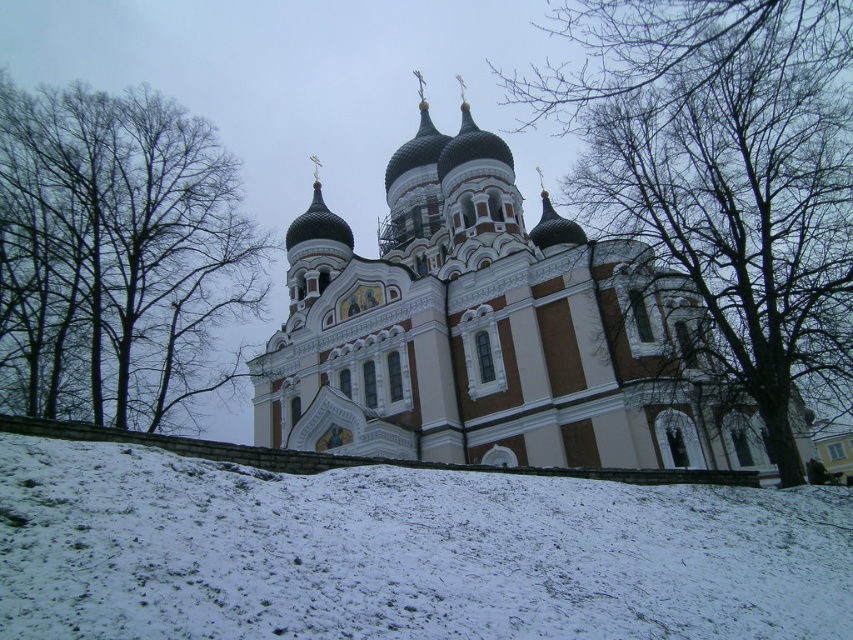
Can you confirm if white stone church at center is smaller than bare branches at upper right?

No, white stone church at center is not smaller than bare branches at upper right.

This screenshot has width=853, height=640. In order to click on white stone church at center in this screenshot , I will do `click(488, 332)`.

Is white stone church at center closer to the viewer compared to brown bark tree at upper left?

Yes, white stone church at center is closer to the viewer.

Based on the photo, who is lower down, white stone church at center or brown bark tree at upper left?

brown bark tree at upper left is below.

Is point (354, 417) in front of point (218, 198)?

Yes, it is.

The height and width of the screenshot is (640, 853). In order to click on white stone church at center in this screenshot , I will do `click(488, 332)`.

Can you confirm if white powdery snow at lower center is shorter than white stone church at center?

Yes, white powdery snow at lower center is shorter than white stone church at center.

Image resolution: width=853 pixels, height=640 pixels. In order to click on white powdery snow at lower center in this screenshot , I will do `click(403, 552)`.